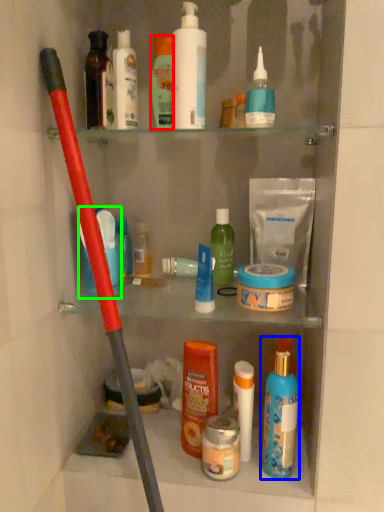
Question: Which is nearer to the toiletry (highlighted by a red box)? toiletry (highlighted by a blue box) or toiletry (highlighted by a green box).

Choices:
 (A) toiletry
 (B) toiletry

Answer: (B)